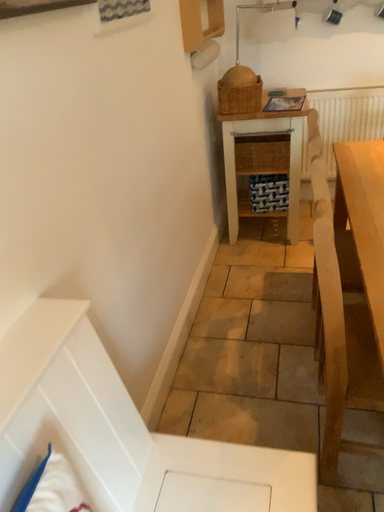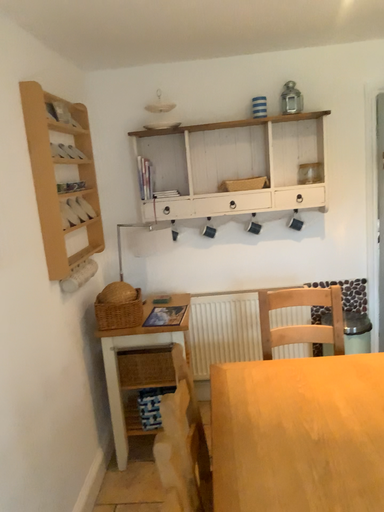
Question: Which way did the camera rotate in the video?

Choices:
 (A) rotated downward
 (B) rotated upward

Answer: (B)